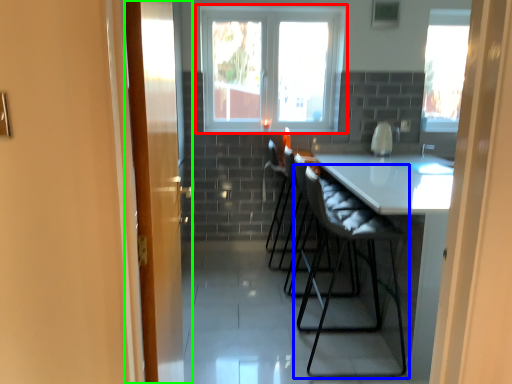
Question: Estimate the real-world distances between objects in this image. Which object is closer to window (highlighted by a red box), chair (highlighted by a blue box) or door (highlighted by a green box)?

Choices:
 (A) chair
 (B) door

Answer: (A)